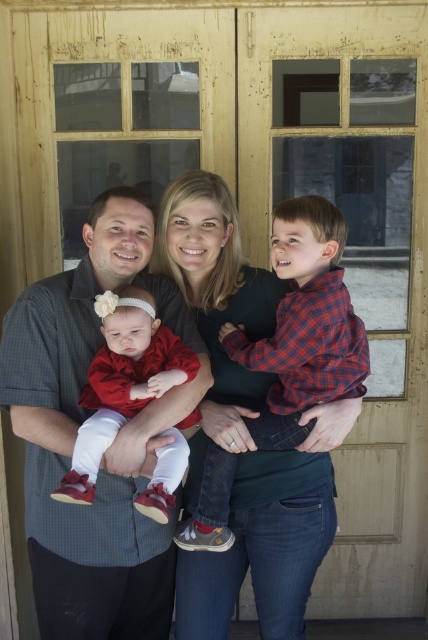
Question: Is the position of plaid cotton shirt at center more distant than that of matte red dress at center?

Choices:
 (A) yes
 (B) no

Answer: (A)

Question: Is brushed metal shirt at center to the right of plaid cotton shirt at center from the viewer's perspective?

Choices:
 (A) no
 (B) yes

Answer: (A)

Question: Estimate the real-world distances between objects in this image. Which object is farther from the plaid cotton shirt at center?

Choices:
 (A) brushed metal shirt at center
 (B) matte red dress at center

Answer: (A)

Question: Among these objects, which one is nearest to the camera?

Choices:
 (A) plaid cotton shirt at center
 (B) brushed metal shirt at center
 (C) matte red dress at center

Answer: (C)

Question: Does brushed metal shirt at center appear on the left side of matte red dress at center?

Choices:
 (A) no
 (B) yes

Answer: (B)

Question: Among these points, which one is nearest to the camera?

Choices:
 (A) (82, 477)
 (B) (92, 618)
 (C) (287, 312)

Answer: (A)